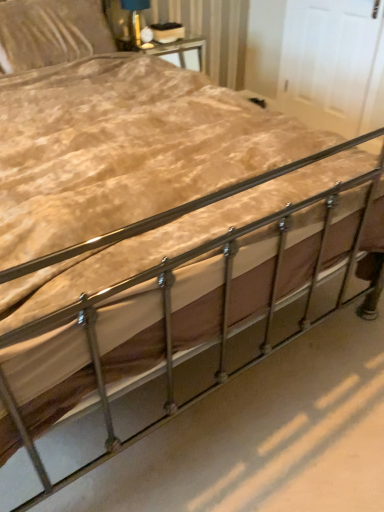
Find the location of a particular element. This screenshot has height=512, width=384. matte black lampshade at upper center is located at coordinates (134, 19).

What do you see at coordinates (134, 19) in the screenshot? I see `matte black lampshade at upper center` at bounding box center [134, 19].

This screenshot has width=384, height=512. What do you see at coordinates (51, 32) in the screenshot? I see `velvet beige pillow at upper left` at bounding box center [51, 32].

Identify the location of velvet beige pillow at upper left. (51, 32).

At what (x,y) coordinates should I click in order to perform the action: click on matte black lampshade at upper center. Please return your answer as a coordinate pair (x, y). Looking at the image, I should click on (134, 19).

Which object is positioned more to the left, matte black lampshade at upper center or velvet beige pillow at upper left?

Positioned to the left is velvet beige pillow at upper left.

Which object is further away from the camera, matte black lampshade at upper center or velvet beige pillow at upper left?

matte black lampshade at upper center is behind.

Does point (138, 45) come closer to viewer compared to point (57, 46)?

No, it is behind (57, 46).

From the image's perspective, does matte black lampshade at upper center appear lower than velvet beige pillow at upper left?

No.

From a real-world perspective, is matte black lampshade at upper center positioned over velvet beige pillow at upper left based on gravity?

Indeed, from a real-world perspective, matte black lampshade at upper center stands above velvet beige pillow at upper left.

Consider the image. Does matte black lampshade at upper center have a lesser width compared to velvet beige pillow at upper left?

Correct, the width of matte black lampshade at upper center is less than that of velvet beige pillow at upper left.

Can you confirm if matte black lampshade at upper center is shorter than velvet beige pillow at upper left?

Yes.

Considering the sizes of objects matte black lampshade at upper center and velvet beige pillow at upper left in the image provided, who is bigger, matte black lampshade at upper center or velvet beige pillow at upper left?

velvet beige pillow at upper left.

Is matte black lampshade at upper center not within velvet beige pillow at upper left?

Yes, matte black lampshade at upper center is outside of velvet beige pillow at upper left.

Can you see matte black lampshade at upper center touching velvet beige pillow at upper left?

No, matte black lampshade at upper center is not next to velvet beige pillow at upper left.

Is matte black lampshade at upper center turned away from velvet beige pillow at upper left?

No, matte black lampshade at upper center's orientation is not away from velvet beige pillow at upper left.

Locate an element on the screen. table lamp behind the velvet beige pillow at upper left is located at coordinates (134, 19).

Is velvet beige pillow at upper left to the left of matte black lampshade at upper center from the viewer's perspective?

Yes.

Is the position of velvet beige pillow at upper left more distant than that of matte black lampshade at upper center?

That is False.

Considering the points (23, 28) and (137, 42), which point is behind, point (23, 28) or point (137, 42)?

The point (137, 42) is more distant.

From the image's perspective, does velvet beige pillow at upper left appear lower than matte black lampshade at upper center?

Indeed, from the image's perspective, velvet beige pillow at upper left is shown beneath matte black lampshade at upper center.

From a real-world perspective, between velvet beige pillow at upper left and matte black lampshade at upper center, who is vertically higher?

matte black lampshade at upper center, from a real-world perspective.

Which of these two, velvet beige pillow at upper left or matte black lampshade at upper center, is thinner?

matte black lampshade at upper center.

Is velvet beige pillow at upper left shorter than matte black lampshade at upper center?

No, velvet beige pillow at upper left is not shorter than matte black lampshade at upper center.

Is velvet beige pillow at upper left smaller than matte black lampshade at upper center?

No.

Is velvet beige pillow at upper left positioned beyond the bounds of matte black lampshade at upper center?

Absolutely, velvet beige pillow at upper left is external to matte black lampshade at upper center.

From the picture: Is velvet beige pillow at upper left next to matte black lampshade at upper center and touching it?

No, velvet beige pillow at upper left is not in contact with matte black lampshade at upper center.

Is velvet beige pillow at upper left aimed at matte black lampshade at upper center?

No, velvet beige pillow at upper left is not turned towards matte black lampshade at upper center.

At what (x,y) coordinates should I click in order to perform the action: click on pillow below the matte black lampshade at upper center (from a real-world perspective). Please return your answer as a coordinate pair (x, y). The image size is (384, 512). Looking at the image, I should click on (51, 32).

You are a GUI agent. You are given a task and a screenshot of the screen. Output one action in this format:
    pyautogui.click(x=<x>, y=<y>)
    Task: Click on the table lamp above the velvet beige pillow at upper left (from the image's perspective)
    
    Given the screenshot: What is the action you would take?
    pyautogui.click(x=134, y=19)

This screenshot has width=384, height=512. What are the coordinates of `pillow that is in front of the matte black lampshade at upper center` in the screenshot? It's located at (51, 32).